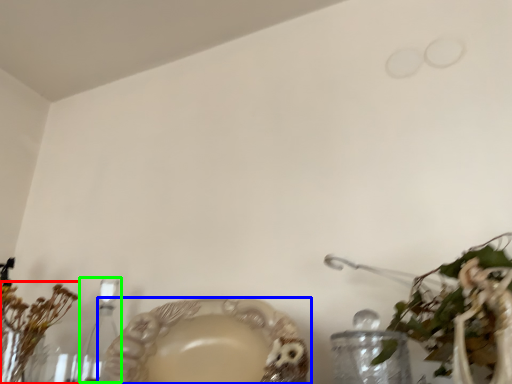
Question: Estimate the real-world distances between objects in this image. Which object is farther from floral arrangement (highlighted by a red box), tableware (highlighted by a blue box) or candle holder (highlighted by a green box)?

Choices:
 (A) tableware
 (B) candle holder

Answer: (A)